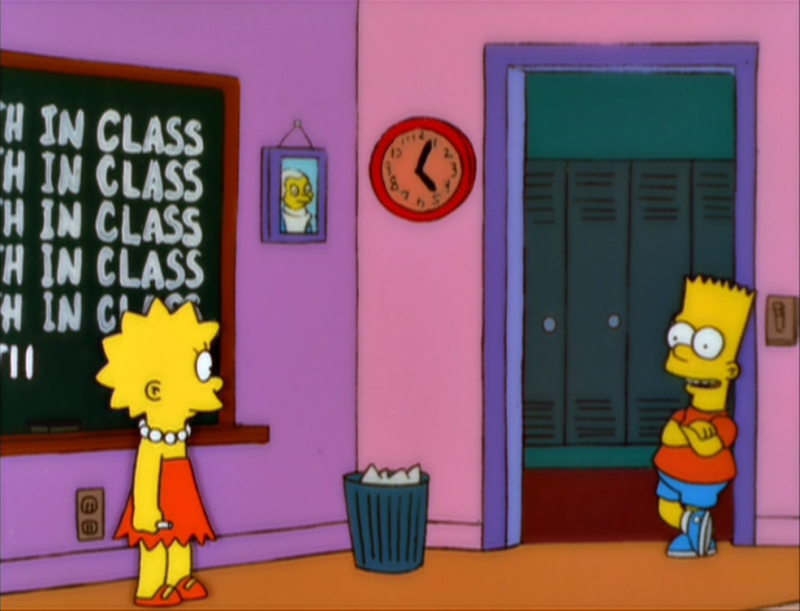
This screenshot has height=611, width=800. What are the coordinates of `clock` in the screenshot? It's located at (434, 142).